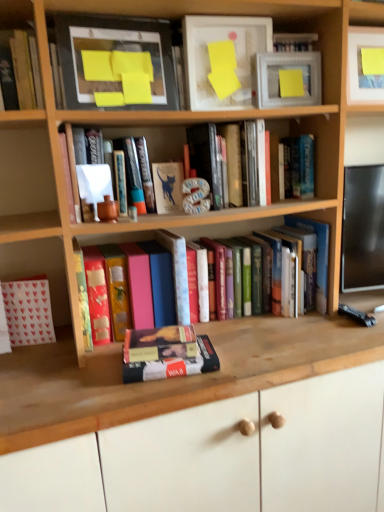
Describe the element at coordinates (117, 290) in the screenshot. This screenshot has height=512, width=384. I see `hardcover book at center, which is counted as the 3th paperback book, starting from the right` at that location.

The width and height of the screenshot is (384, 512). I want to click on hardcover book at center, the 3th paperback book positioned from the top, so click(117, 290).

What do you see at coordinates (235, 57) in the screenshot?
I see `matte yellow paper at upper center, the third paperback book positioned from the bottom` at bounding box center [235, 57].

Based on the photo, how much space does matte yellow paper at upper center, the third paperback book positioned from the bottom, occupy horizontally?

It is 2.57 inches.

Locate an element on the screen. The image size is (384, 512). hardcover book at center, positioned as the 2th book in right-to-left order is located at coordinates (166, 353).

You are a GUI agent. You are given a task and a screenshot of the screen. Output one action in this format:
    pyautogui.click(x=<x>, y=<y>)
    Task: Click on the pink matte book at center, the 2th paperback book ordered from the bottom
    
    Given the screenshot: What is the action you would take?
    pyautogui.click(x=161, y=283)

Describe the element at coordinates (23, 69) in the screenshot. The width and height of the screenshot is (384, 512). I see `hardcover book at upper left, arranged as the second book when viewed from the left` at that location.

This screenshot has width=384, height=512. I want to click on hardcover book at upper left, arranged as the second book when viewed from the left, so click(x=23, y=69).

What is the approximate width of matte white picture frame at upper right, which appears as the 1th picture frame when viewed from the right?

matte white picture frame at upper right, which appears as the 1th picture frame when viewed from the right, is 3.49 centimeters in width.

What do you see at coordinates (288, 79) in the screenshot? I see `matte white picture frame at upper right, which appears as the 1th picture frame when viewed from the right` at bounding box center [288, 79].

What do you see at coordinates (28, 311) in the screenshot?
I see `white paper bag at lower left, which appears as the 1th book when viewed from the left` at bounding box center [28, 311].

Image resolution: width=384 pixels, height=512 pixels. Identify the location of matte white book at upper center, which appears as the third book when viewed from the left. (81, 164).

Identify the location of the 4th book counting from the left of the matte yellow paper at upper center, the first paperback book positioned from the right. The width and height of the screenshot is (384, 512). (23, 69).

Looking at this image, does matte yellow paper at upper center, the third paperback book positioned from the bottom, have a greater width compared to hardcover book at upper left, arranged as the second book when viewed from the left?

In fact, matte yellow paper at upper center, the third paperback book positioned from the bottom, might be narrower than hardcover book at upper left, arranged as the second book when viewed from the left.

Is matte yellow paper at upper center, the first paperback book positioned from the right, bigger than hardcover book at upper left, which is the 4th book in right-to-left order?

Yes.

From a real-world perspective, is matte yellow paper at upper center, positioned as the 1th paperback book in top-to-bottom order, positioned above or below hardcover book at upper left, which is the 4th book in right-to-left order?

Clearly, from a real-world perspective, matte yellow paper at upper center, positioned as the 1th paperback book in top-to-bottom order, is above hardcover book at upper left, which is the 4th book in right-to-left order.

From the picture: Between hardcover book at center, which is the 4th book in left-to-right order, and hardcover book at center, the first paperback book when ordered from bottom to top, which one has smaller width?

hardcover book at center, which is the 4th book in left-to-right order.

From a real-world perspective, is hardcover book at center, which is the 4th book in left-to-right order, located beneath hardcover book at center, the 3th paperback book positioned from the top?

Indeed, from a real-world perspective, hardcover book at center, which is the 4th book in left-to-right order, is positioned beneath hardcover book at center, the 3th paperback book positioned from the top.

Considering the sizes of objects hardcover book at center, which is the 4th book in left-to-right order, and hardcover book at center, the 3th paperback book positioned from the top, in the image provided, who is smaller, hardcover book at center, which is the 4th book in left-to-right order, or hardcover book at center, the 3th paperback book positioned from the top,?

hardcover book at center, which is the 4th book in left-to-right order.

From the image's perspective, is hardcover book at center, which is the 4th book in left-to-right order, below hardcover book at center, the first paperback book when ordered from bottom to top?

Yes, from the image's perspective, hardcover book at center, which is the 4th book in left-to-right order, is below hardcover book at center, the first paperback book when ordered from bottom to top.

Which is behind, point (164, 362) or point (74, 143)?

The point (74, 143) is more distant.

Considering the relative positions of hardcover book at center, positioned as the 2th book in right-to-left order, and matte white book at upper center, the third book from the right, in the image provided, is hardcover book at center, positioned as the 2th book in right-to-left order, behind matte white book at upper center, the third book from the right,?

No, the depth of hardcover book at center, positioned as the 2th book in right-to-left order, is less than that of matte white book at upper center, the third book from the right.

Does hardcover book at center, which is the 4th book in left-to-right order, have a smaller size compared to matte white book at upper center, the third book from the right?

Yes, hardcover book at center, which is the 4th book in left-to-right order, is smaller than matte white book at upper center, the third book from the right.

Locate an element on the screen. book that is the 2nd object located above the hardcover book at center, which is the 4th book in left-to-right order (from the image's perspective) is located at coordinates (81, 164).

Where is `book that is the 3rd one when counting downward from the matte white picture frame at upper right, positioned as the 2th picture frame in left-to-right order (from the image's perspective)`? The width and height of the screenshot is (384, 512). book that is the 3rd one when counting downward from the matte white picture frame at upper right, positioned as the 2th picture frame in left-to-right order (from the image's perspective) is located at coordinates (81, 164).

Between matte white picture frame at upper right, which appears as the 1th picture frame when viewed from the right, and matte white book at upper center, which appears as the third book when viewed from the left, which one appears on the right side from the viewer's perspective?

Positioned to the right is matte white picture frame at upper right, which appears as the 1th picture frame when viewed from the right.

Which of these two, matte white picture frame at upper right, positioned as the 2th picture frame in left-to-right order, or matte white book at upper center, which appears as the third book when viewed from the left, is bigger?

With larger size is matte white book at upper center, which appears as the third book when viewed from the left.

Find the location of `book on the left of hardcover book at upper left, arranged as the second book when viewed from the left`. book on the left of hardcover book at upper left, arranged as the second book when viewed from the left is located at coordinates (28, 311).

Considering the positions of objects hardcover book at upper left, which is the 4th book in right-to-left order, and white paper bag at lower left, which appears as the 1th book when viewed from the left, in the image provided, who is in front, hardcover book at upper left, which is the 4th book in right-to-left order, or white paper bag at lower left, which appears as the 1th book when viewed from the left,?

hardcover book at upper left, which is the 4th book in right-to-left order, is more forward.

Is hardcover book at upper left, which is the 4th book in right-to-left order, facing towards white paper bag at lower left, which appears as the 1th book when viewed from the left?

No.

Is hardcover book at upper left, arranged as the second book when viewed from the left, not close to white paper bag at lower left, the fifth book positioned from the right?

No, there isn't a large distance between hardcover book at upper left, arranged as the second book when viewed from the left, and white paper bag at lower left, the fifth book positioned from the right.

Does matte white picture frame at upper right, which appears as the 1th picture frame when viewed from the right, have a larger size compared to hardcover book at center, which is the fifth book from left to right?

Incorrect, matte white picture frame at upper right, which appears as the 1th picture frame when viewed from the right, is not larger than hardcover book at center, which is the fifth book from left to right.

Which is in front, point (299, 83) or point (257, 169)?

The point (299, 83) is more forward.

Considering the sizes of objects matte white picture frame at upper right, which appears as the 1th picture frame when viewed from the right, and hardcover book at center, which is the fifth book from left to right, in the image provided, who is thinner, matte white picture frame at upper right, which appears as the 1th picture frame when viewed from the right, or hardcover book at center, which is the fifth book from left to right,?

matte white picture frame at upper right, which appears as the 1th picture frame when viewed from the right.

Based on the photo, is matte white picture frame at upper right, which appears as the 1th picture frame when viewed from the right, directly adjacent to hardcover book at center, positioned as the 1th book in right-to-left order?

No, matte white picture frame at upper right, which appears as the 1th picture frame when viewed from the right, is not touching hardcover book at center, positioned as the 1th book in right-to-left order.

From a real-world perspective, is white paper bag at lower left, which appears as the 1th book when viewed from the left, over hardcover book at upper left, arranged as the second book when viewed from the left?

No, from a real-world perspective, white paper bag at lower left, which appears as the 1th book when viewed from the left, is not on top of hardcover book at upper left, arranged as the second book when viewed from the left.

From the image's perspective, is white paper bag at lower left, the fifth book positioned from the right, above hardcover book at upper left, which is the 4th book in right-to-left order?

No, from the image's perspective, white paper bag at lower left, the fifth book positioned from the right, is not on top of hardcover book at upper left, which is the 4th book in right-to-left order.

Considering the sizes of objects white paper bag at lower left, which appears as the 1th book when viewed from the left, and hardcover book at upper left, which is the 4th book in right-to-left order, in the image provided, who is shorter, white paper bag at lower left, which appears as the 1th book when viewed from the left, or hardcover book at upper left, which is the 4th book in right-to-left order,?

Standing shorter between the two is white paper bag at lower left, which appears as the 1th book when viewed from the left.

Where is `book on the left of hardcover book at upper left, arranged as the second book when viewed from the left`? This screenshot has height=512, width=384. book on the left of hardcover book at upper left, arranged as the second book when viewed from the left is located at coordinates (28, 311).

The image size is (384, 512). What are the coordinates of `paperback book above the hardcover book at upper left, arranged as the second book when viewed from the left (from the image's perspective)` in the screenshot? It's located at (235, 57).

Identify the location of book that is the 2nd object directly below the hardcover book at center, the 3th paperback book positioned from the top (from a real-world perspective). The image size is (384, 512). (166, 353).

Based on their spatial positions, is wooden at lower center or hardcover book at center, the 3th paperback book positioned from the top, closer to hardcover book at center, which is the 4th book in left-to-right order?

hardcover book at center, the 3th paperback book positioned from the top, lies closer to hardcover book at center, which is the 4th book in left-to-right order, than the other object.

From the image, which object appears to be farther from hardcover book at center, the 3th paperback book positioned from the top, matte black picture frame at upper left, which ranks as the first picture frame in left-to-right order, or matte white book at upper center, the third book from the right?

Among the two, matte black picture frame at upper left, which ranks as the first picture frame in left-to-right order, is located further to hardcover book at center, the 3th paperback book positioned from the top.

From the picture: Which object lies nearer to the anchor point matte white book at upper center, the third book from the right, hardcover book at center, which is the 4th book in left-to-right order, or hardcover book at center, which is counted as the 3th paperback book, starting from the right?

hardcover book at center, which is counted as the 3th paperback book, starting from the right, is closer to matte white book at upper center, the third book from the right.

Considering their positions, is matte black picture frame at upper left, the 2th picture frame from the right, positioned further to pink matte book at center, which is the second paperback book in top-to-bottom order, than white paper bag at lower left, the fifth book positioned from the right?

Among the two, matte black picture frame at upper left, the 2th picture frame from the right, is located further to pink matte book at center, which is the second paperback book in top-to-bottom order.

Which object lies further to the anchor point hardcover book at center, which is the 4th book in left-to-right order, hardcover book at center, positioned as the 1th book in right-to-left order, or hardcover book at center, the first paperback book when ordered from bottom to top?

Among the two, hardcover book at center, positioned as the 1th book in right-to-left order, is located further to hardcover book at center, which is the 4th book in left-to-right order.

Based on their spatial positions, is matte yellow paper at upper center, the 3th paperback book positioned from the left, or matte white picture frame at upper right, positioned as the 2th picture frame in left-to-right order, closer to white paper bag at lower left, which appears as the 1th book when viewed from the left?

matte yellow paper at upper center, the 3th paperback book positioned from the left, is closer to white paper bag at lower left, which appears as the 1th book when viewed from the left.

Which object lies nearer to the anchor point hardcover book at center, which is the fifth book from left to right, matte white picture frame at upper right, which appears as the 1th picture frame when viewed from the right, or hardcover book at upper left, which is the 4th book in right-to-left order?

Based on the image, matte white picture frame at upper right, which appears as the 1th picture frame when viewed from the right, appears to be nearer to hardcover book at center, which is the fifth book from left to right.

Which object lies nearer to the anchor point white paper bag at lower left, which appears as the 1th book when viewed from the left, matte yellow paper at upper center, the first paperback book positioned from the right, or hardcover book at upper left, arranged as the second book when viewed from the left?

hardcover book at upper left, arranged as the second book when viewed from the left, lies closer to white paper bag at lower left, which appears as the 1th book when viewed from the left, than the other object.

This screenshot has height=512, width=384. Find the location of `book that lies between hardcover book at center, which is the fifth book from left to right, and pink matte book at center, which is the second paperback book in top-to-bottom order, from top to bottom`. book that lies between hardcover book at center, which is the fifth book from left to right, and pink matte book at center, which is the second paperback book in top-to-bottom order, from top to bottom is located at coordinates (81, 164).

You are a GUI agent. You are given a task and a screenshot of the screen. Output one action in this format:
    pyautogui.click(x=<x>, y=<y>)
    Task: Click on the picture frame located between matte white book at upper center, which appears as the third book when viewed from the left, and matte white picture frame at upper right, which appears as the 1th picture frame when viewed from the right, in the left-right direction
    
    Given the screenshot: What is the action you would take?
    pyautogui.click(x=115, y=61)

The width and height of the screenshot is (384, 512). What are the coordinates of `paperback book that lies between matte yellow paper at upper center, the first paperback book positioned from the right, and hardcover book at center, which is counted as the 3th paperback book, starting from the right, from top to bottom` in the screenshot? It's located at (161, 283).

The height and width of the screenshot is (512, 384). Identify the location of paperback book between matte white book at upper center, which appears as the third book when viewed from the left, and hardcover book at center, which appears as the 1th paperback book when viewed from the left, from top to bottom. (161, 283).